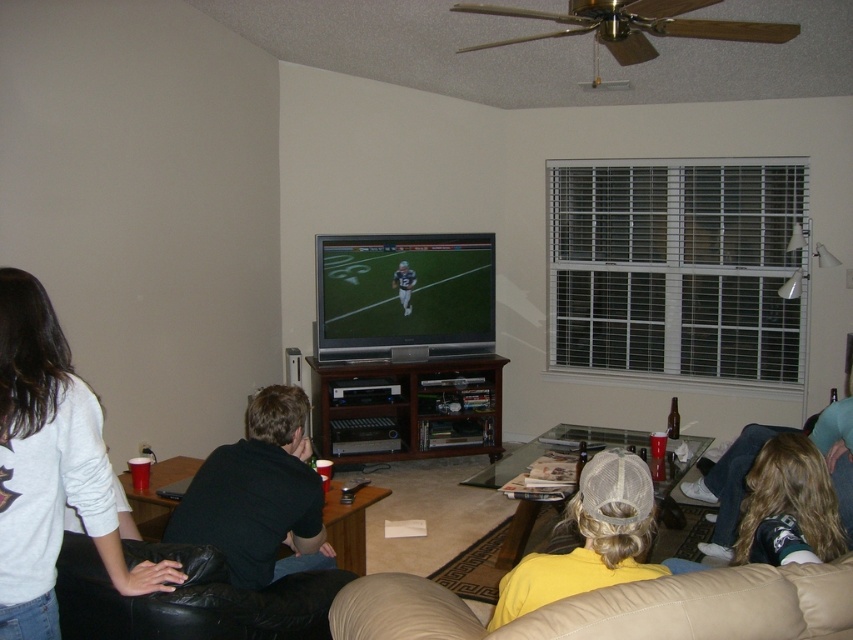
Is beige leather couch at lower right closer to camera compared to yellow mesh cap at lower center?

Yes, beige leather couch at lower right is in front of yellow mesh cap at lower center.

Can you confirm if beige leather couch at lower right is positioned to the left of yellow mesh cap at lower center?

Correct, you'll find beige leather couch at lower right to the left of yellow mesh cap at lower center.

Is point (381, 618) positioned in front of point (573, 573)?

Yes, it is.

The height and width of the screenshot is (640, 853). What are the coordinates of `beige leather couch at lower right` in the screenshot? It's located at point(616,608).

Is white cotton shirt at lower left wider than black cotton shirt at center?

Incorrect, white cotton shirt at lower left's width does not surpass black cotton shirt at center's.

Between white cotton shirt at lower left and black cotton shirt at center, which one appears on the left side from the viewer's perspective?

white cotton shirt at lower left is more to the left.

Between point (67, 380) and point (271, 422), which one is positioned in front?

Point (67, 380) is in front.

Image resolution: width=853 pixels, height=640 pixels. I want to click on white cotton shirt at lower left, so click(50, 467).

Who is taller, black cotton shirt at center or black leather couch at lower left?

black cotton shirt at center is taller.

From the picture: Can you confirm if black cotton shirt at center is positioned above black leather couch at lower left?

Yes, black cotton shirt at center is above black leather couch at lower left.

Who is more distant from viewer, [236,497] or [65,636]?

Point [236,497]

The width and height of the screenshot is (853, 640). I want to click on black cotton shirt at center, so click(x=258, y=496).